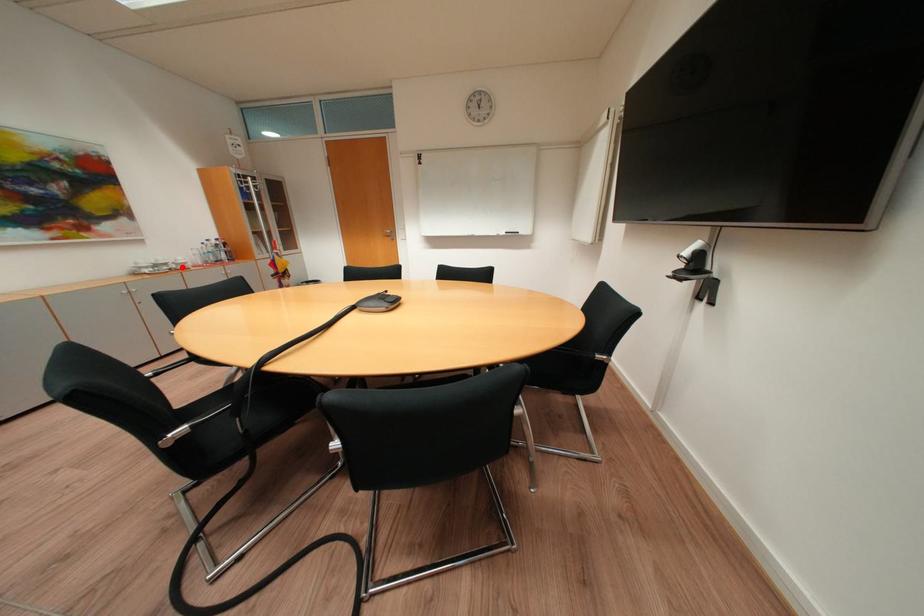
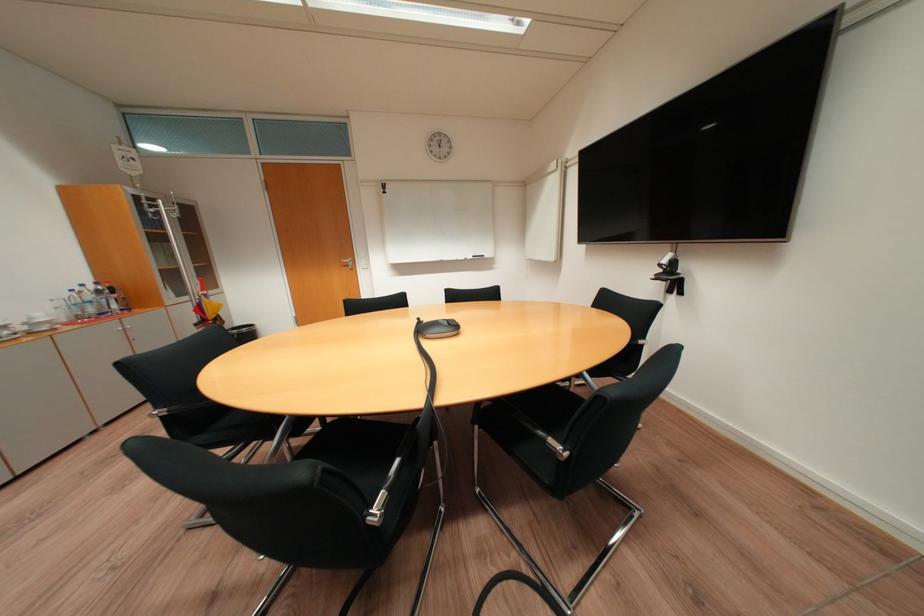
Where in the second image is the point corresponding to the highlighted location from the first image?

(31, 330)